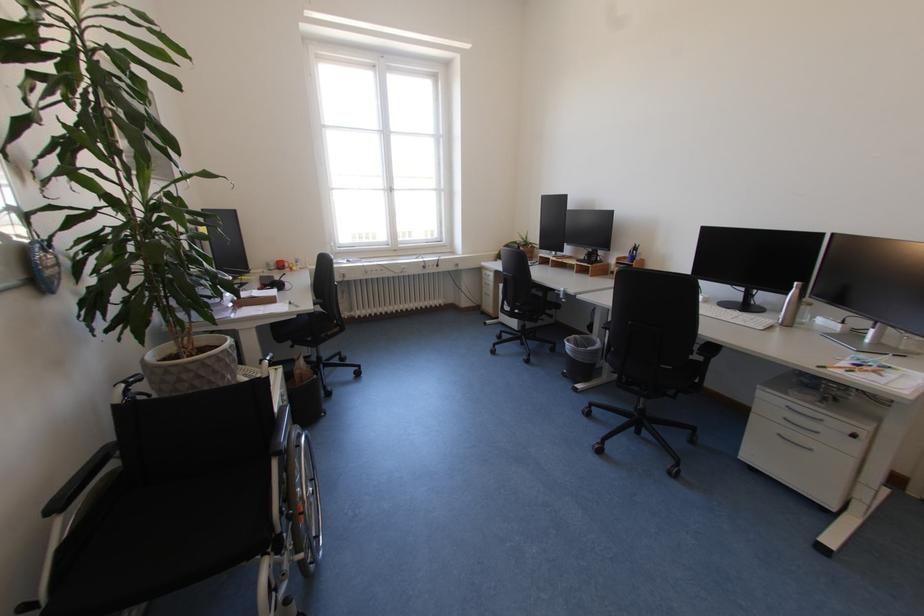
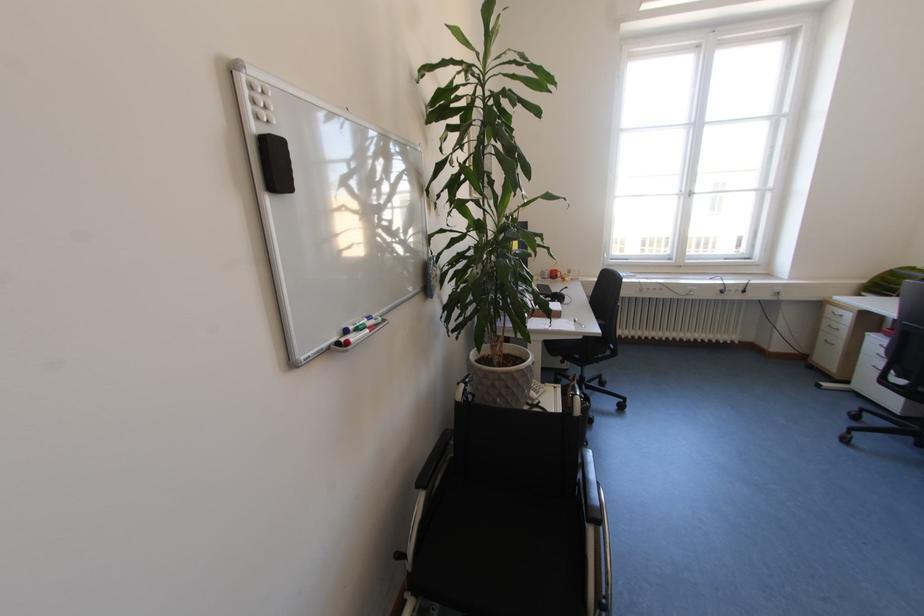
Locate, in the second image, the point that corresponds to [492,277] in the first image.

(835, 315)